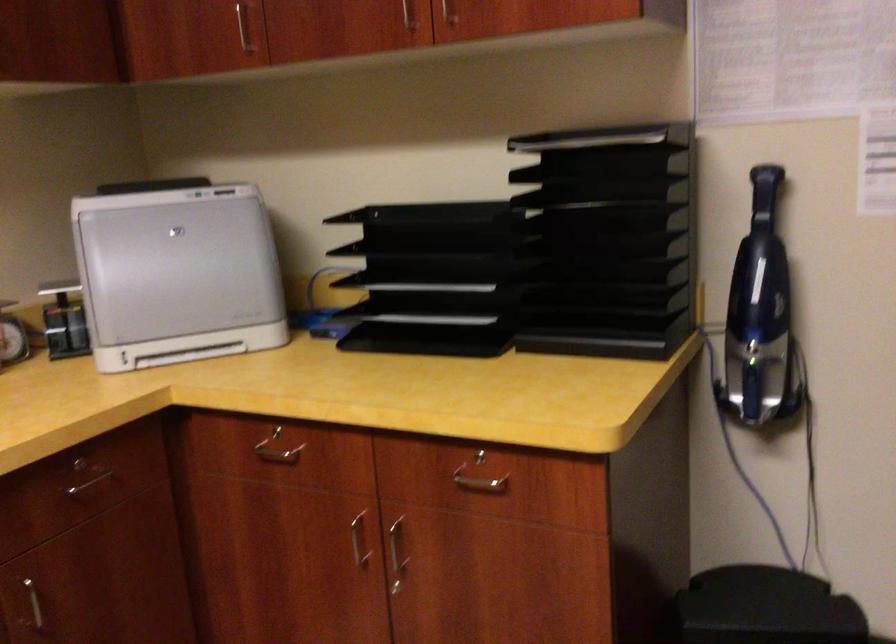
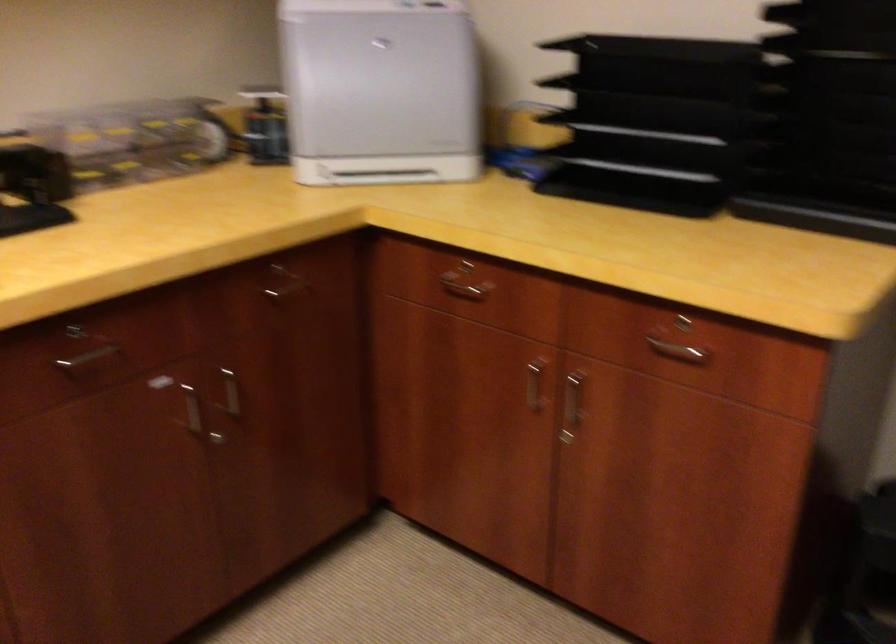
Where in the second image is the point corresponding to pixel 186 353 from the first image?

(380, 176)